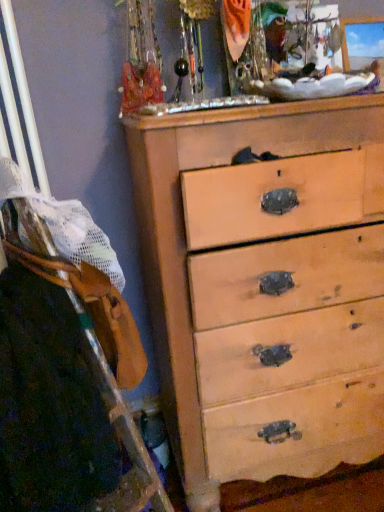
Question: From a real-world perspective, relative to wooden ladder at left, is light wood chest of drawers at center vertically above or below?

Choices:
 (A) above
 (B) below

Answer: (B)

Question: Is light wood chest of drawers at center in front of or behind wooden ladder at left in the image?

Choices:
 (A) behind
 (B) front

Answer: (A)

Question: Is light wood chest of drawers at center bigger or smaller than wooden ladder at left?

Choices:
 (A) big
 (B) small

Answer: (A)

Question: Considering their positions, is wooden ladder at left located in front of or behind light wood chest of drawers at center?

Choices:
 (A) front
 (B) behind

Answer: (A)

Question: Is wooden ladder at left bigger or smaller than light wood chest of drawers at center?

Choices:
 (A) small
 (B) big

Answer: (A)

Question: Is wooden ladder at left situated inside light wood chest of drawers at center or outside?

Choices:
 (A) outside
 (B) inside

Answer: (A)

Question: Considering the positions of point (84, 366) and point (190, 464), is point (84, 366) closer or farther from the camera than point (190, 464)?

Choices:
 (A) closer
 (B) farther

Answer: (A)